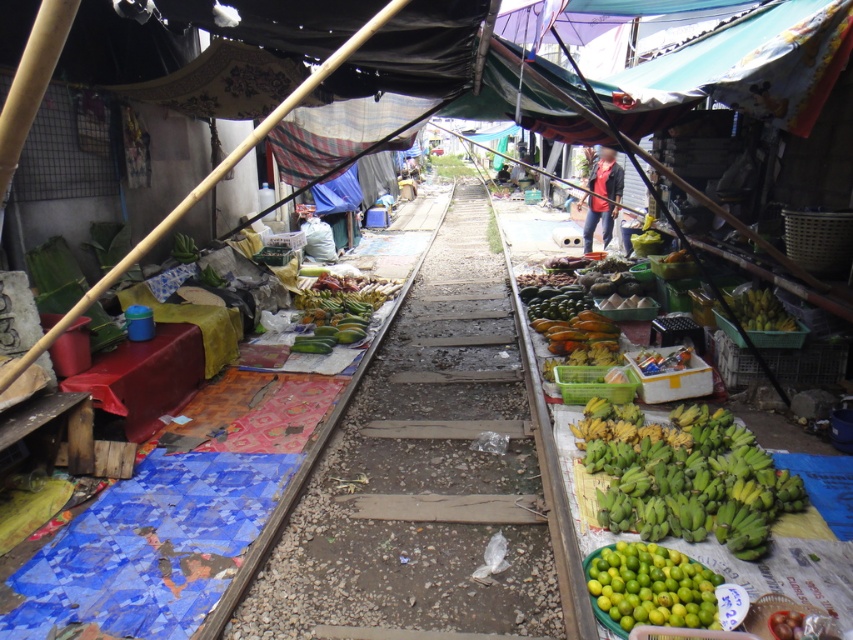
Question: Can you confirm if green matte bananas at right is thinner than dark blue denim jacket at center?

Choices:
 (A) no
 (B) yes

Answer: (A)

Question: Which of the following is the closest to the observer?

Choices:
 (A) green matte bananas at right
 (B) green fabric vendor at center
 (C) green matte limes at lower right
 (D) green matte bananas at center-right

Answer: (C)

Question: Is the position of green matte bananas at right more distant than that of green matte limes at lower right?

Choices:
 (A) no
 (B) yes

Answer: (B)

Question: Which point appears farthest from the camera in this image?

Choices:
 (A) (329, 584)
 (B) (654, 484)
 (C) (325, 259)
 (D) (608, 195)

Answer: (C)

Question: Which object is the farthest from the green fabric vendor at center?

Choices:
 (A) brown wooden train track at center
 (B) green matte limes at lower right

Answer: (B)

Question: Can you confirm if green matte limes at lower right is bigger than green matte bananas at left?

Choices:
 (A) yes
 (B) no

Answer: (A)